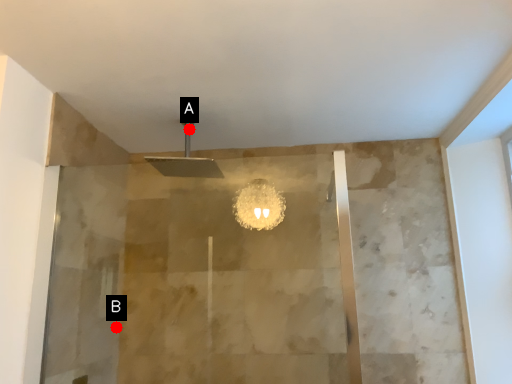
Question: Two points are circled on the image, labeled by A and B beside each circle. Among these points, which one is farthest from the camera?

Choices:
 (A) A is further
 (B) B is further

Answer: (B)